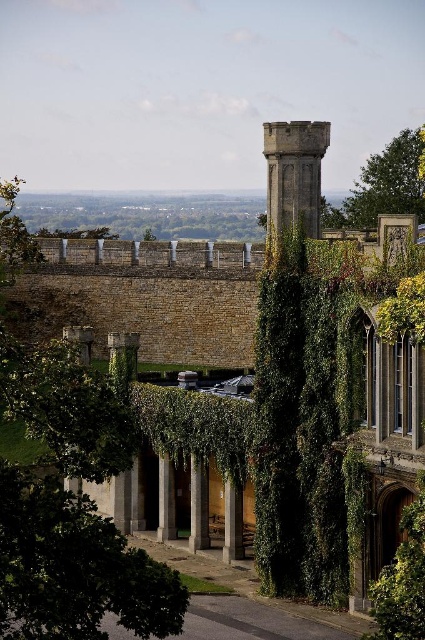
You are an architect analyzing the spatial layout of the scene. Given the green leafy tree at left and the stone tower at upper center, which one has a greater horizontal spread in the image?

The green leafy tree at left has a greater horizontal spread than the stone tower at upper center, as its width is larger according to the description.

You are an architect evaluating the spatial relationship between the green leafy tree at left and the stone tower at upper center. Which object occupies a greater area in the image?

The green leafy tree at left has a larger size compared to the stone tower at upper center, so it occupies a greater area in the image.